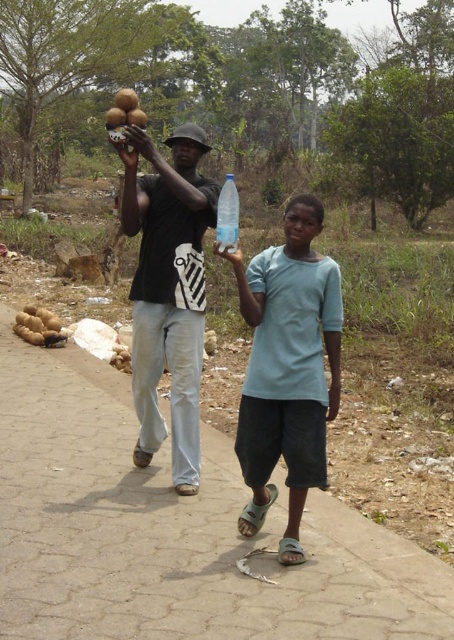
Question: Which is farther from the transparent plastic bottle at center?

Choices:
 (A) paved concrete sidewalk at center
 (B) matte black coconut at left
 (C) light blue cotton shirt at center
 (D) black matte shirt at center

Answer: (A)

Question: Is light blue cotton shirt at center thinner than black matte shirt at center?

Choices:
 (A) no
 (B) yes

Answer: (B)

Question: In this image, where is matte black coconut at left located relative to light blue cotton shirt at center?

Choices:
 (A) below
 (B) above

Answer: (B)

Question: Is light blue cotton shirt at center further to the viewer compared to black matte shirt at center?

Choices:
 (A) no
 (B) yes

Answer: (A)

Question: Estimate the real-world distances between objects in this image. Which object is closer to the matte black coconut at left?

Choices:
 (A) transparent plastic bottle at center
 (B) light blue cotton shirt at center

Answer: (B)

Question: Which of the following is the closest to the observer?

Choices:
 (A) click(220, 232)
 (B) click(266, 253)

Answer: (B)